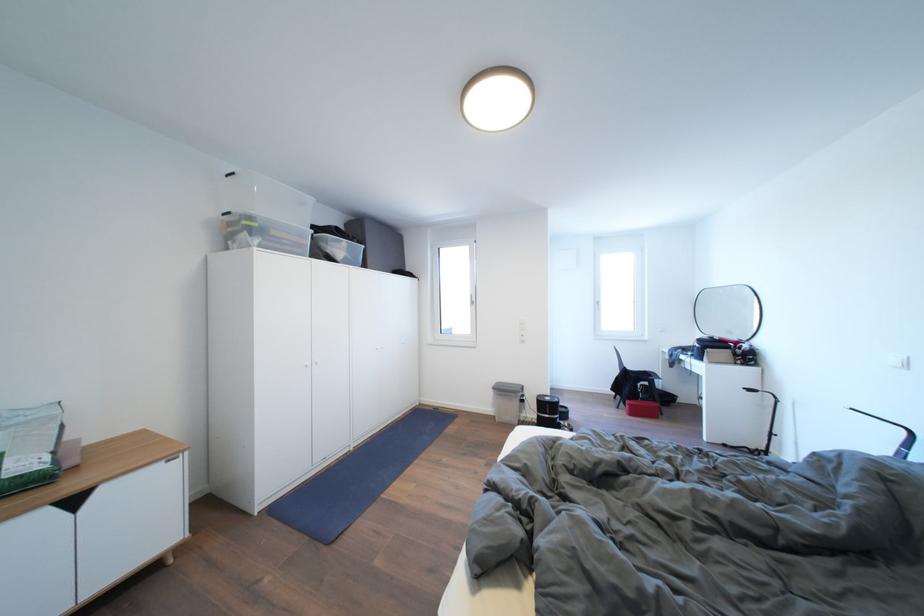
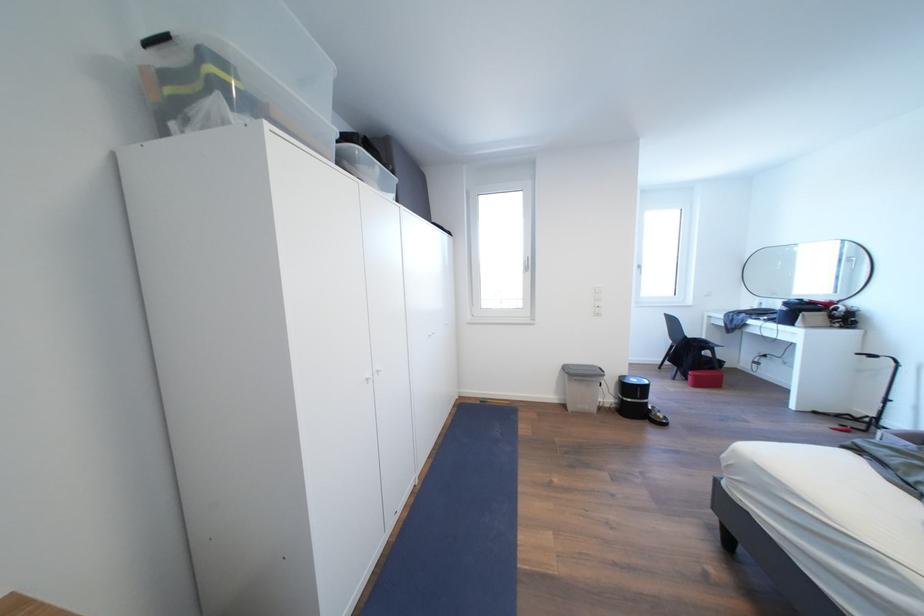
Where in the second image is the point corresponding to (x=555, y=403) from the first image?

(641, 386)